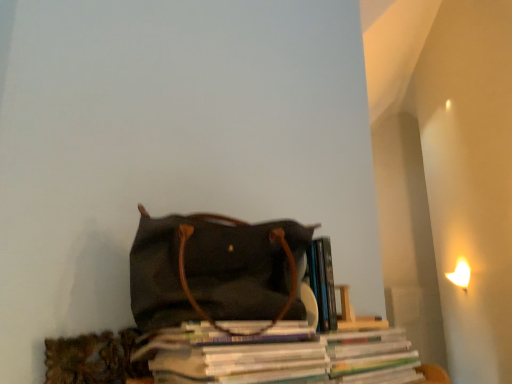
This screenshot has height=384, width=512. Describe the element at coordinates (294, 360) in the screenshot. I see `white glossy magazine at center` at that location.

Find the location of `white glossy magazine at center`. white glossy magazine at center is located at coordinates (294, 360).

What is the approximate width of canvas handbag at center?

canvas handbag at center is 32.97 centimeters wide.

Describe the element at coordinates (214, 269) in the screenshot. The image size is (512, 384). I see `canvas handbag at center` at that location.

This screenshot has width=512, height=384. In order to click on canvas handbag at center in this screenshot , I will do `click(214, 269)`.

What are the coordinates of `white glossy magazine at center` in the screenshot? It's located at (294, 360).

Considering the positions of objects white glossy magazine at center and canvas handbag at center in the image provided, who is more to the left, white glossy magazine at center or canvas handbag at center?

canvas handbag at center.

From the picture: In the image, is white glossy magazine at center positioned in front of or behind canvas handbag at center?

Visually, white glossy magazine at center is located in front of canvas handbag at center.

Is point (343, 351) positioned before point (252, 319)?

That is False.

From the image's perspective, which object appears higher, white glossy magazine at center or canvas handbag at center?

canvas handbag at center.

Consider the image. From a real-world perspective, is white glossy magazine at center physically below canvas handbag at center?

Yes.

Is white glossy magazine at center wider or thinner than canvas handbag at center?

Considering their sizes, white glossy magazine at center looks slimmer than canvas handbag at center.

Does white glossy magazine at center have a greater height compared to canvas handbag at center?

Incorrect, the height of white glossy magazine at center is not larger of that of canvas handbag at center.

Based on their sizes in the image, would you say white glossy magazine at center is bigger or smaller than canvas handbag at center?

white glossy magazine at center is smaller than canvas handbag at center.

Could canvas handbag at center be considered to be inside white glossy magazine at center?

No, white glossy magazine at center does not contain canvas handbag at center.

Is white glossy magazine at center not near canvas handbag at center?

No, white glossy magazine at center is in close proximity to canvas handbag at center.

Looking at this image, is white glossy magazine at center looking in the opposite direction of canvas handbag at center?

No.

Can you tell me how much white glossy magazine at center and canvas handbag at center differ in facing direction?

The angle between the facing direction of white glossy magazine at center and the facing direction of canvas handbag at center is 0.000742 degrees.

Where is `magazine in front of the canvas handbag at center`? The height and width of the screenshot is (384, 512). magazine in front of the canvas handbag at center is located at coordinates (294, 360).

Looking at this image, is canvas handbag at center at the right side of white glossy magazine at center?

Incorrect, canvas handbag at center is not on the right side of white glossy magazine at center.

In the image, is canvas handbag at center positioned in front of or behind white glossy magazine at center?

In the image, canvas handbag at center appears behind white glossy magazine at center.

Is point (133, 316) closer or farther from the camera than point (344, 382)?

Point (133, 316) is positioned farther from the camera compared to point (344, 382).

From the image's perspective, would you say canvas handbag at center is positioned over white glossy magazine at center?

Yes, from the image's perspective, canvas handbag at center is on top of white glossy magazine at center.

From a real-world perspective, is canvas handbag at center positioned under white glossy magazine at center based on gravity?

No, from a real-world perspective, canvas handbag at center is not under white glossy magazine at center.

Can you confirm if canvas handbag at center is wider than white glossy magazine at center?

Indeed, canvas handbag at center has a greater width compared to white glossy magazine at center.

From the picture: In terms of height, does canvas handbag at center look taller or shorter compared to white glossy magazine at center?

Clearly, canvas handbag at center is taller compared to white glossy magazine at center.

Considering the relative sizes of canvas handbag at center and white glossy magazine at center in the image provided, is canvas handbag at center smaller than white glossy magazine at center?

No.

Choose the correct answer: Is canvas handbag at center inside white glossy magazine at center or outside it?

canvas handbag at center cannot be found inside white glossy magazine at center.

Is canvas handbag at center not close to white glossy magazine at center?

No, canvas handbag at center is not far away from white glossy magazine at center.

Is canvas handbag at center facing towards white glossy magazine at center?

No.

Can you tell me how much canvas handbag at center and white glossy magazine at center differ in facing direction?

canvas handbag at center and white glossy magazine at center are facing 0.000742 degrees away from each other.

The width and height of the screenshot is (512, 384). Find the location of `handbag that appears above the white glossy magazine at center (from a real-world perspective)`. handbag that appears above the white glossy magazine at center (from a real-world perspective) is located at coordinates (214, 269).

I want to click on handbag above the white glossy magazine at center (from the image's perspective), so click(214, 269).

This screenshot has height=384, width=512. I want to click on handbag behind the white glossy magazine at center, so click(x=214, y=269).